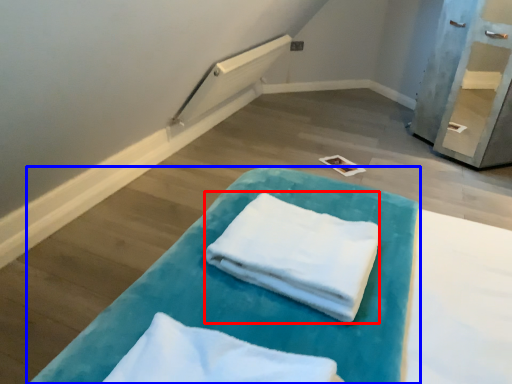
Question: Which object is closer to the camera taking this photo, cloth (highlighted by a red box) or furniture (highlighted by a blue box)?

Choices:
 (A) cloth
 (B) furniture

Answer: (B)